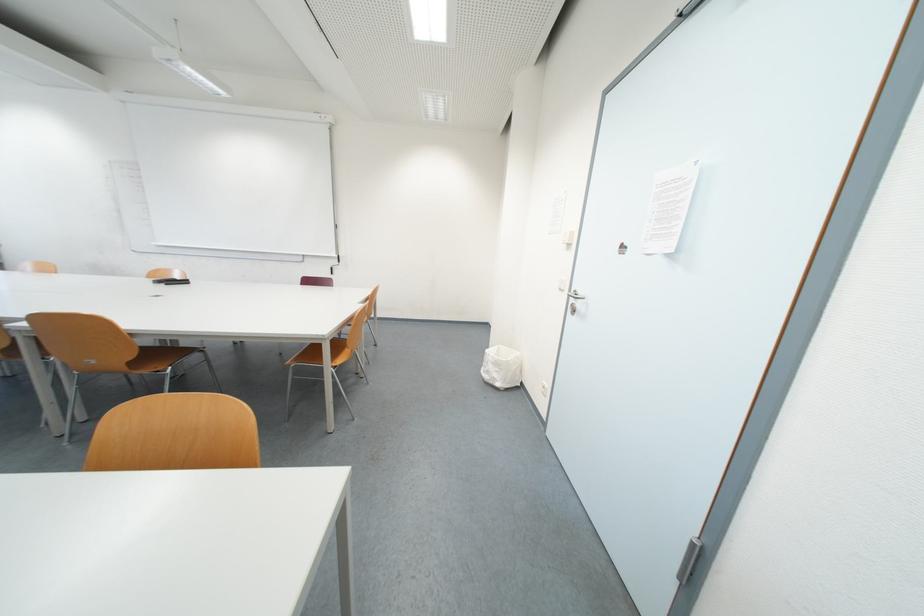
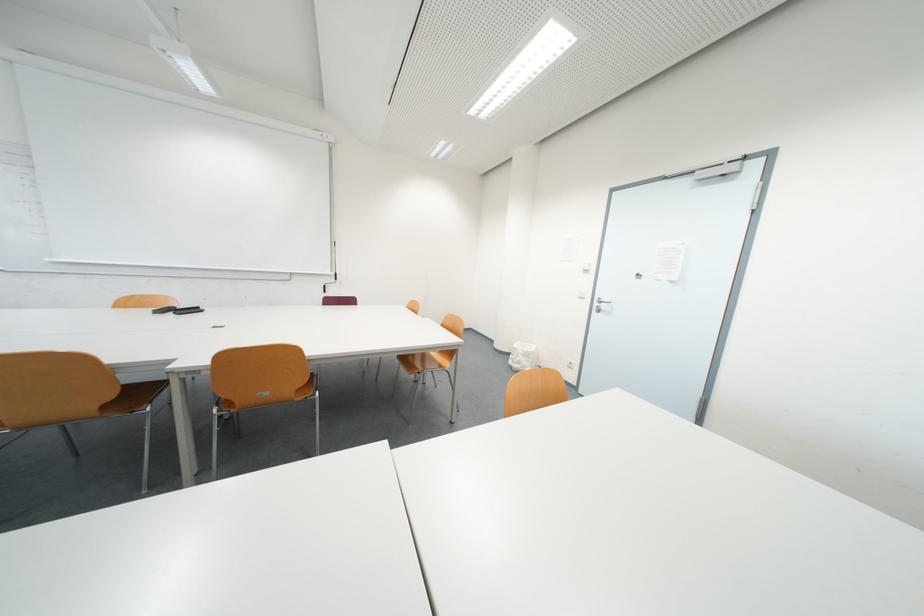
Where in the second image is the point corresponding to the point at 497,373 from the first image?

(529, 363)